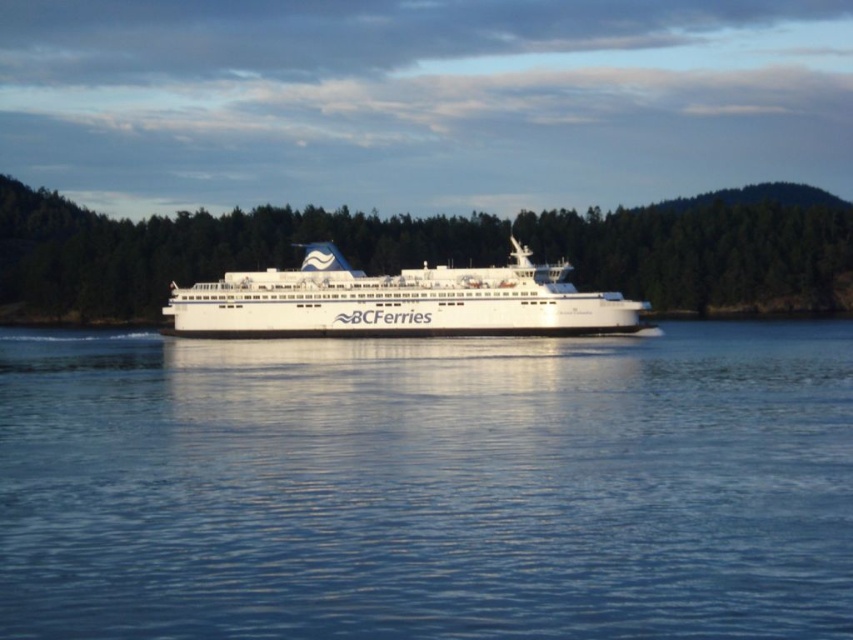
Is point (582, 465) in front of point (57, 234)?

Yes, it is in front of point (57, 234).

Does point (193, 467) lie in front of point (132, 282)?

Yes.

Locate an element on the screen. Image resolution: width=853 pixels, height=640 pixels. blue liquid water at center is located at coordinates (428, 484).

Is green matte trees at center taller than white glossy ferry at center?

Yes, green matte trees at center is taller than white glossy ferry at center.

Who is more forward, (335, 212) or (254, 304)?

Positioned in front is point (254, 304).

Image resolution: width=853 pixels, height=640 pixels. What are the coordinates of `green matte trees at center` in the screenshot? It's located at (439, 250).

Who is taller, blue liquid water at center or white glossy ferry at center?

With more height is white glossy ferry at center.

Based on the photo, which is more to the right, blue liquid water at center or white glossy ferry at center?

blue liquid water at center

Is point (805, 611) farther from camera compared to point (593, 323)?

No, it is not.

Locate an element on the screen. blue liquid water at center is located at coordinates (428, 484).